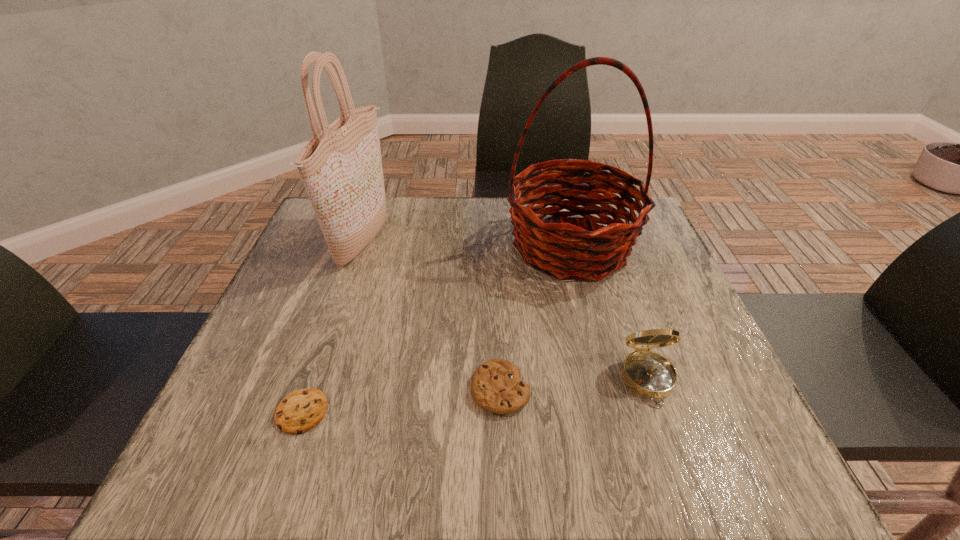
Where is `vacant space that satisfies the following two spatial constraints: 1. on the front side of the taller cookie; 2. on the left side of the shopping bag`? This screenshot has height=540, width=960. vacant space that satisfies the following two spatial constraints: 1. on the front side of the taller cookie; 2. on the left side of the shopping bag is located at coordinates (313, 389).

The height and width of the screenshot is (540, 960). Find the location of `vacant point that satisfies the following two spatial constraints: 1. on the back side of the shortest object; 2. on the right side of the basket`. vacant point that satisfies the following two spatial constraints: 1. on the back side of the shortest object; 2. on the right side of the basket is located at coordinates (x=358, y=246).

Identify the location of blank space that satisfies the following two spatial constraints: 1. on the back side of the shorter cookie; 2. on the left side of the shopping bag. (360, 241).